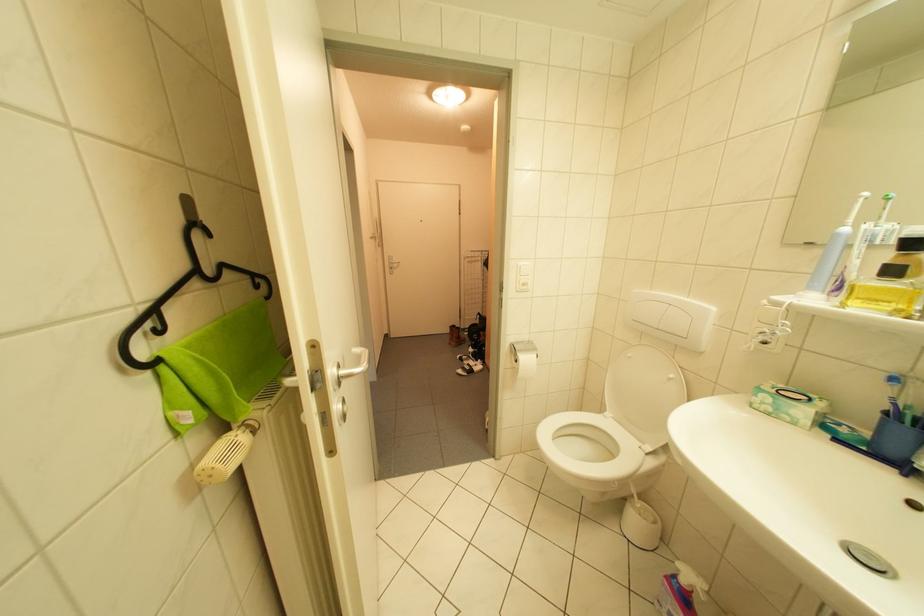
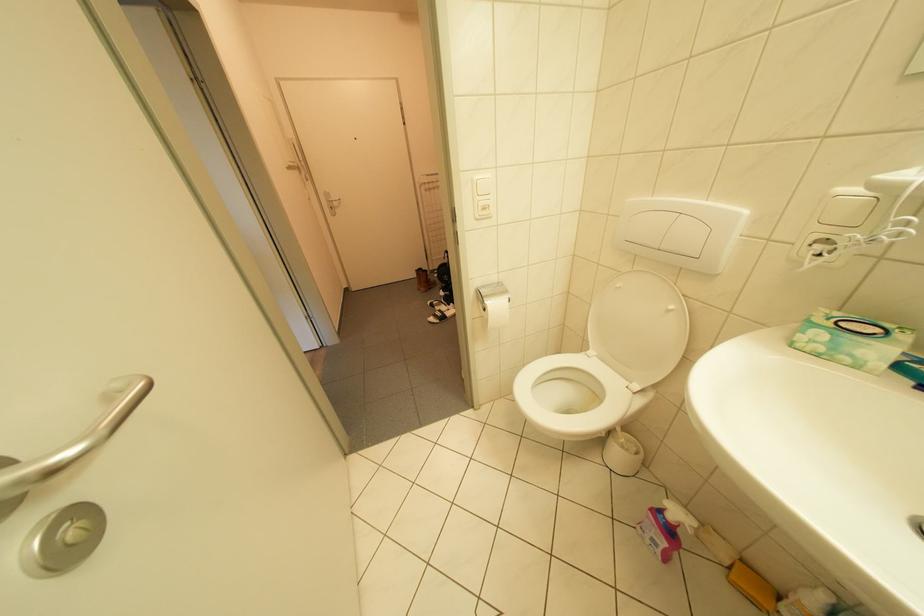
Question: The first image is from the beginning of the video and the second image is from the end. How did the camera likely rotate when shooting the video?

Choices:
 (A) Left
 (B) Right
 (C) Up
 (D) Down

Answer: (D)